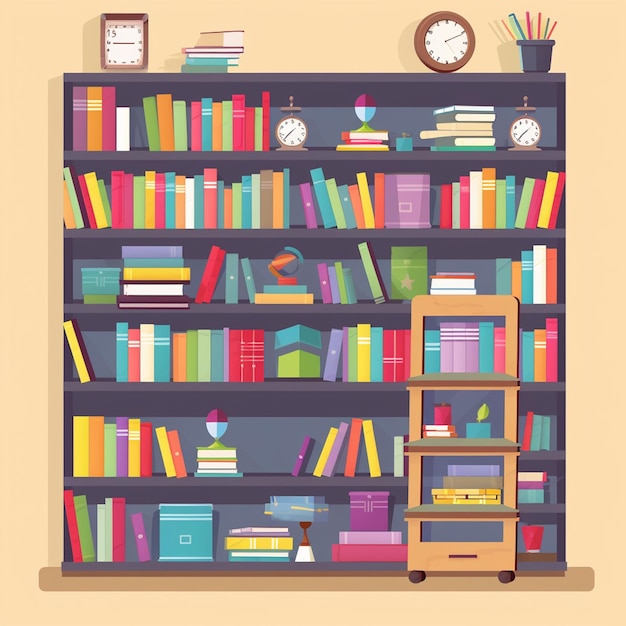
Locate an element on the screen. The width and height of the screenshot is (626, 626). orange books is located at coordinates (91, 448), (552, 284), (490, 206), (520, 287), (538, 362), (173, 360), (163, 126), (218, 129), (95, 129).